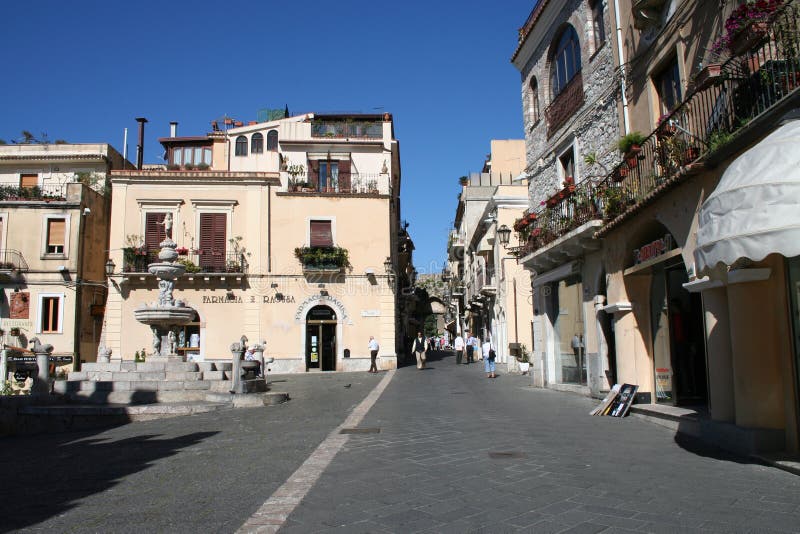
The width and height of the screenshot is (800, 534). Find the location of `window`. window is located at coordinates (564, 54).